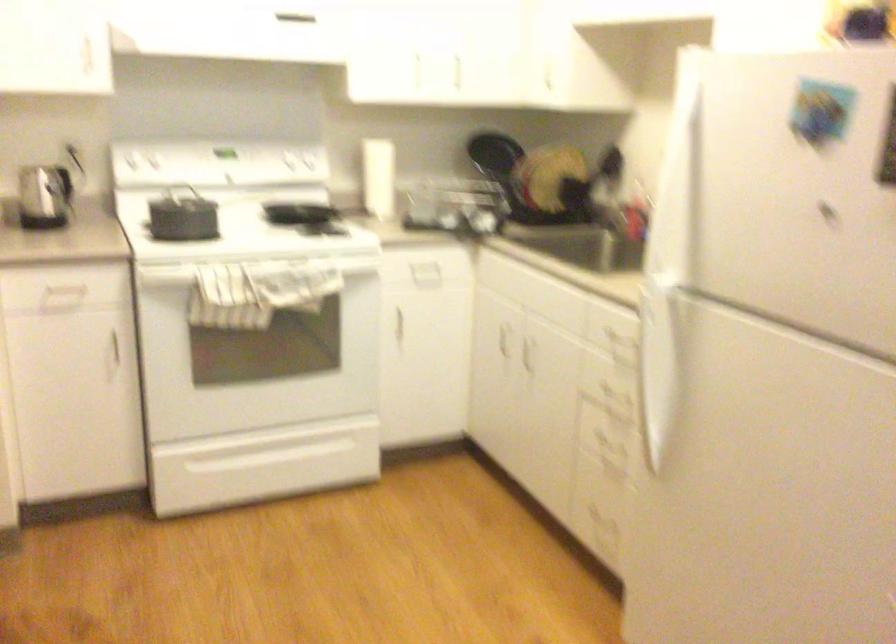
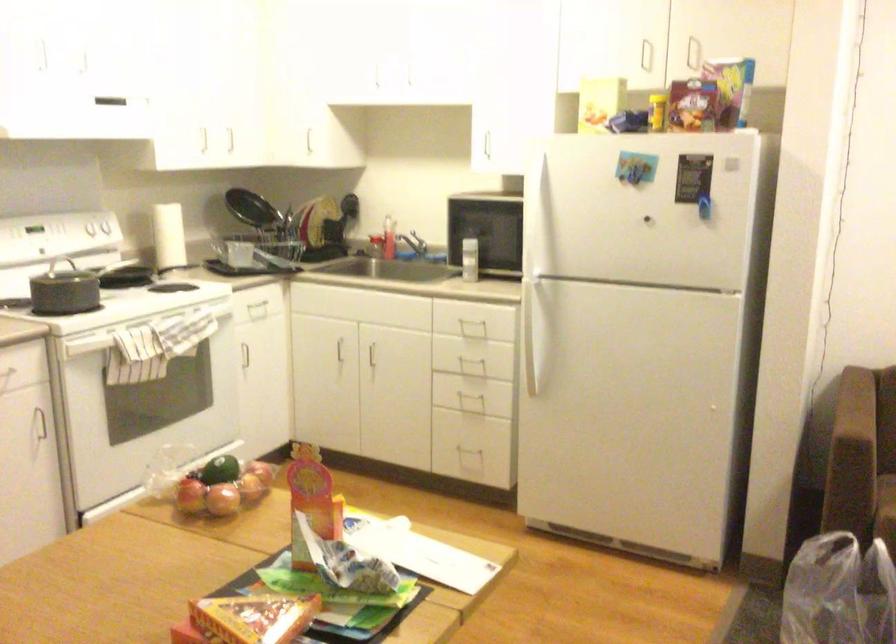
Find the pixel in the second image that matches point (650, 375) in the first image.

(536, 328)